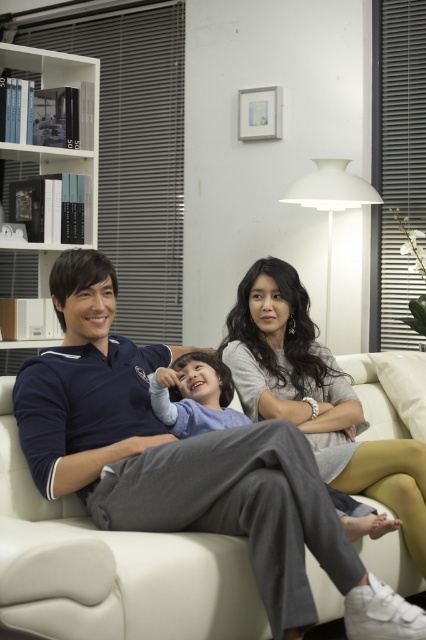
Describe the element at coordinates (112, 568) in the screenshot. I see `white leather couch at center` at that location.

Which is behind, point (43, 582) or point (336, 474)?

Point (336, 474)

Is point (241, 604) positioned before point (336, 464)?

Yes, point (241, 604) is closer to viewer.

Identify the location of white leather couch at center. (112, 568).

Is white leather couch at center below light blue fabric shirt at center?

Yes.

Is point (155, 628) positioned before point (187, 420)?

Yes, it is.

Which is behind, point (146, 628) or point (158, 390)?

Point (158, 390)

This screenshot has height=640, width=426. I want to click on white leather couch at center, so [x=112, y=568].

Is gray knit sweater at center bigger than light blue fabric shirt at center?

Yes, gray knit sweater at center is bigger than light blue fabric shirt at center.

Locate an element on the screen. The width and height of the screenshot is (426, 640). gray knit sweater at center is located at coordinates (316, 396).

Between point (273, 349) and point (233, 416), which one is positioned behind?

Positioned behind is point (273, 349).

Image resolution: width=426 pixels, height=640 pixels. I want to click on gray knit sweater at center, so click(x=316, y=396).